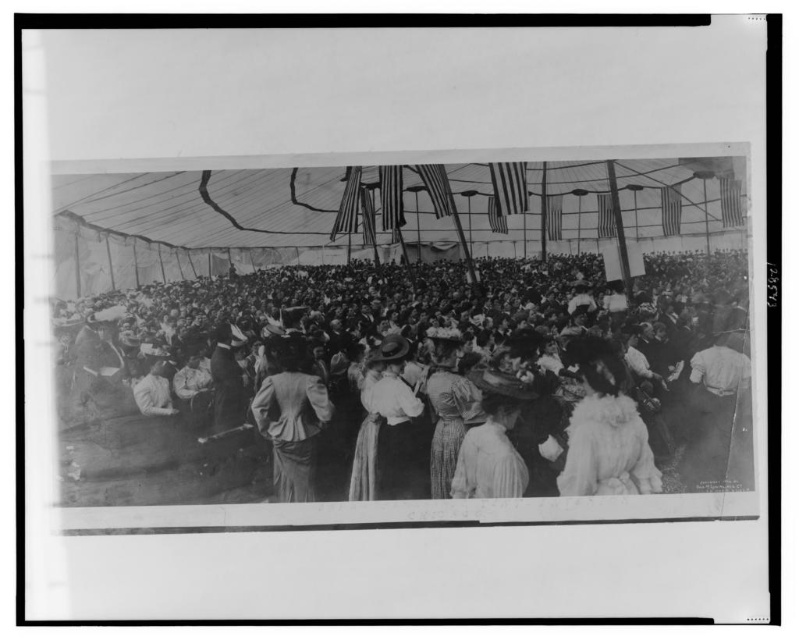
Which is below, white cotton dresses at center or fuzzy white coat at center?

Positioned lower is fuzzy white coat at center.

At what (x,y) coordinates should I click in order to perform the action: click on white cotton dresses at center. Please return your answer as a coordinate pair (x, y). The height and width of the screenshot is (640, 799). Looking at the image, I should click on (411, 381).

Between white cotton dress at center and light pink fabric dress at center, which one appears on the right side from the viewer's perspective?

light pink fabric dress at center

Can you confirm if white cotton dress at center is wider than light pink fabric dress at center?

No, white cotton dress at center is not wider than light pink fabric dress at center.

Between point (396, 360) and point (491, 493), which one is positioned behind?

The point (396, 360) is behind.

Where is `white cotton dress at center`? This screenshot has width=799, height=640. white cotton dress at center is located at coordinates (388, 428).

Who is shorter, light pink fabric dress at center or patterned fabric dress at center?

light pink fabric dress at center is shorter.

I want to click on light pink fabric dress at center, so click(x=491, y=442).

At what (x,y) coordinates should I click in order to perform the action: click on light pink fabric dress at center. Please return your answer as a coordinate pair (x, y). This screenshot has width=799, height=640. Looking at the image, I should click on (491, 442).